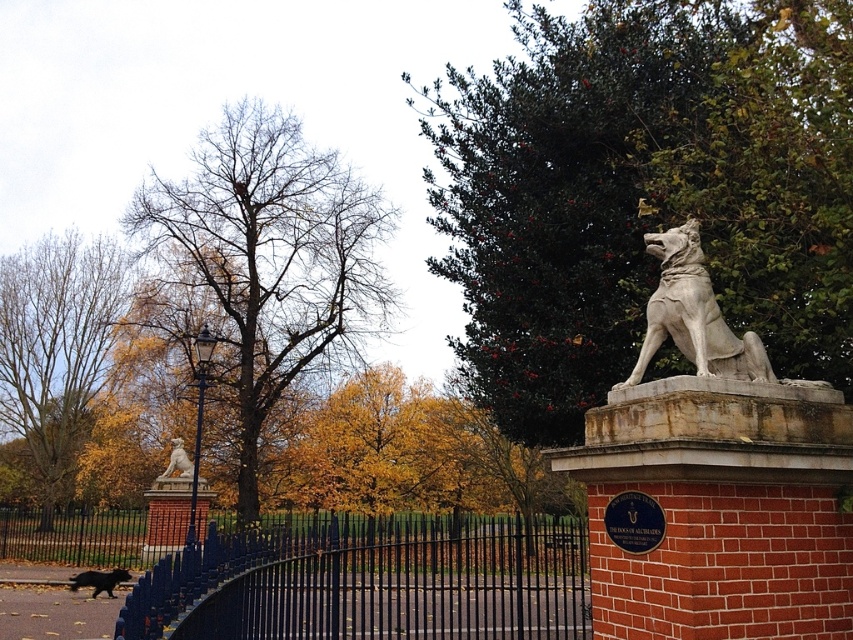
Question: Which point is closer to the camera?

Choices:
 (A) green leafy tree at upper right
 (B) white stone dog at upper right
 (C) brown leafy tree at upper left

Answer: (B)

Question: Among these objects, which one is nearest to the camera?

Choices:
 (A) white marble lioness at lower left
 (B) brown leafy tree at upper left
 (C) shiny black dog at lower left
 (D) yellow leaves at upper left

Answer: (C)

Question: Is blue painted metal fence at lower center thinner than white marble lioness at lower left?

Choices:
 (A) no
 (B) yes

Answer: (A)

Question: Which object is farther from the camera taking this photo?

Choices:
 (A) green leafy tree at upper right
 (B) brown leafy tree at upper left
 (C) blue painted metal fence at lower center

Answer: (B)

Question: Can you confirm if yellow leaves at upper left is positioned above shiny black dog at lower left?

Choices:
 (A) yes
 (B) no

Answer: (A)

Question: Is brown leafy tree at upper left positioned at the back of shiny black dog at lower left?

Choices:
 (A) yes
 (B) no

Answer: (A)